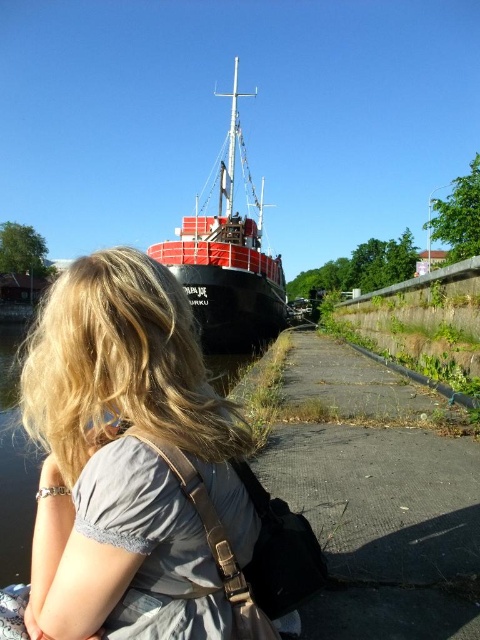
You are standing at the point labeled point [37,376] and want to walk to the point labeled point [204,241]. Given that the walkway between them is 2 meters wide, can you safely walk straight towards your destination without stepping off the walkway?

Point [37,376] is closer to the viewer than point [204,241]. Since the walkway is 2 meters wide, you can safely walk straight towards point [204,241] without stepping off the walkway as long as you stay within the walkway boundaries.

You are a tour guide leading a group to the red matte ship at center. A tourist asks if they can walk directly from their current position at the blonde hair at center to the ship without crossing any obstacles. Based on the scene description, what do you tell them?

The distance between the blonde hair at center and the red matte ship at center is 24.01 meters. Since the scene mentions a paved walkway along the riverbank where the ship is docked, it is likely that there is a clear path. However, the walkway shows signs of wear and overgrowth, so while it might be passable, there could be uneven surfaces or vegetation to navigate around. Advise the tourist to proceed with caution but confirm the direct path is possible.